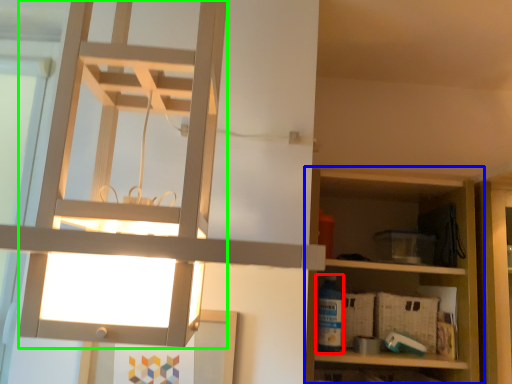
Question: Considering the real-world distances, which object is farthest from bottle (highlighted by a red box)? shelf (highlighted by a blue box) or lamp (highlighted by a green box)?

Choices:
 (A) shelf
 (B) lamp

Answer: (B)